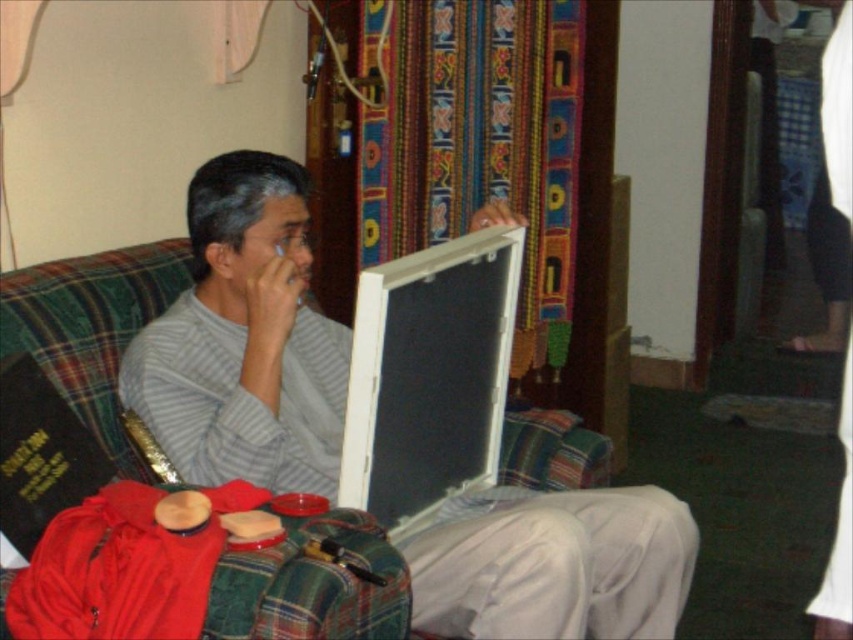
You are a delivery person who needs to place a small package between the gray striped shirt at center and the white plastic laptop at center. Can you fit it there?

The gray striped shirt at center is 9.10 inches away from the white plastic laptop at center, so yes, the small package can fit between them since the distance is sufficient.

Looking at this image, based on the scene description, what are the coordinates of the gray striped shirt at center?

The gray striped shirt at center is located at coordinates point (244, 339).

You are trying to reach the white plastic laptop at center from the gray striped shirt at center. Which direction should you move to get there?

To reach the white plastic laptop at center from the gray striped shirt at center, you should move to the right since the gray striped shirt at center is located to the left of the white plastic laptop at center.